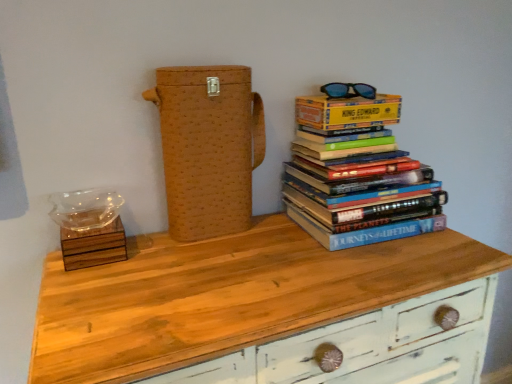
This screenshot has height=384, width=512. I want to click on free spot in front of brown woven box at center, so click(x=203, y=261).